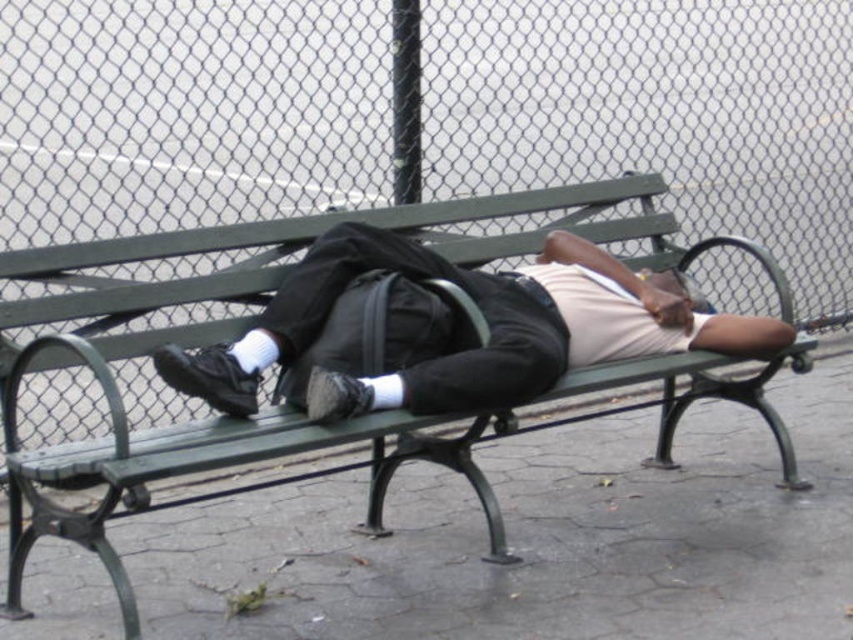
Does green wood park bench at center have a greater width compared to black matte backpack at center?

Yes, green wood park bench at center is wider than black matte backpack at center.

Who is taller, green wood park bench at center or black matte backpack at center?

green wood park bench at center is taller.

Is point (126, 493) farther from viewer compared to point (318, 392)?

No.

The width and height of the screenshot is (853, 640). Identify the location of green wood park bench at center. (187, 422).

Can you confirm if wire mesh fence at upper center is positioned above green wood park bench at center?

Yes.

Based on the photo, does wire mesh fence at upper center have a smaller size compared to green wood park bench at center?

No, wire mesh fence at upper center is not smaller than green wood park bench at center.

Locate an element on the screen. The height and width of the screenshot is (640, 853). wire mesh fence at upper center is located at coordinates (657, 115).

The height and width of the screenshot is (640, 853). Find the location of `wire mesh fence at upper center`. wire mesh fence at upper center is located at coordinates (657, 115).

Is wire mesh fence at upper center further to camera compared to black matte backpack at center?

Yes, it is behind black matte backpack at center.

Can you confirm if wire mesh fence at upper center is smaller than black matte backpack at center?

Incorrect, wire mesh fence at upper center is not smaller in size than black matte backpack at center.

What are the coordinates of `wire mesh fence at upper center` in the screenshot? It's located at (657, 115).